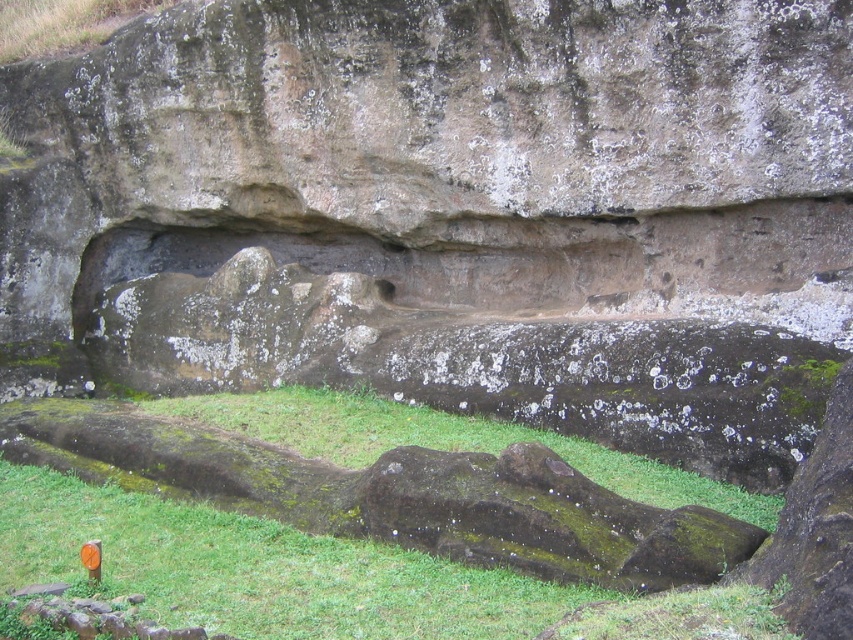
You are standing at the origin point of the coordinate system in the image. You want to place a small decorative stone at the green mossy grass at lower center. What are the coordinates where you should place the stone?

The coordinates for the green mossy grass at lower center are at point (x=318, y=576).

You are standing in front of the rock formation and notice two areas of green mossy grass. The first is labeled as green mossy grass at lower center and the second as green mossy grass at center. Which of these two areas is closer to your viewpoint?

The green mossy grass at lower center is closer to your viewpoint because it is in front of the green mossy grass at center.